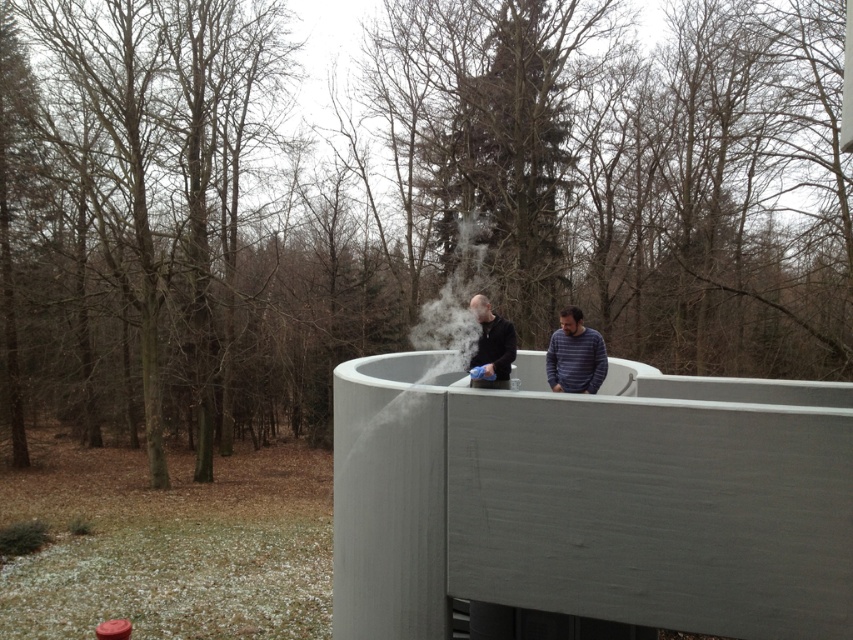
Between point (422, 337) and point (497, 369), which one is positioned behind?

Positioned behind is point (422, 337).

Who is more forward, (334, 387) or (560, 346)?

Point (334, 387) is more forward.

Image resolution: width=853 pixels, height=640 pixels. What do you see at coordinates (427, 344) in the screenshot?
I see `white vapor at center` at bounding box center [427, 344].

Locate an element on the screen. This screenshot has height=640, width=853. white vapor at center is located at coordinates (427, 344).

Between brown leafless tree at left and white vapor at center, which one has more height?

With more height is brown leafless tree at left.

Looking at this image, which is above, brown leafless tree at left or white vapor at center?

brown leafless tree at left is above.

Who is more distant from viewer, [85,301] or [457,244]?

The point [457,244] is more distant.

The height and width of the screenshot is (640, 853). I want to click on brown leafless tree at left, so click(154, 186).

Which is above, striped cotton shirt at center or matte black jacket at center?

matte black jacket at center is higher up.

Does striped cotton shirt at center have a greater height compared to matte black jacket at center?

Indeed, striped cotton shirt at center has a greater height compared to matte black jacket at center.

Does point (560, 333) come closer to viewer compared to point (471, 365)?

No, (560, 333) is further to viewer.

At what (x,y) coordinates should I click in order to perform the action: click on striped cotton shirt at center. Please return your answer as a coordinate pair (x, y). Image resolution: width=853 pixels, height=640 pixels. Looking at the image, I should click on (575, 355).